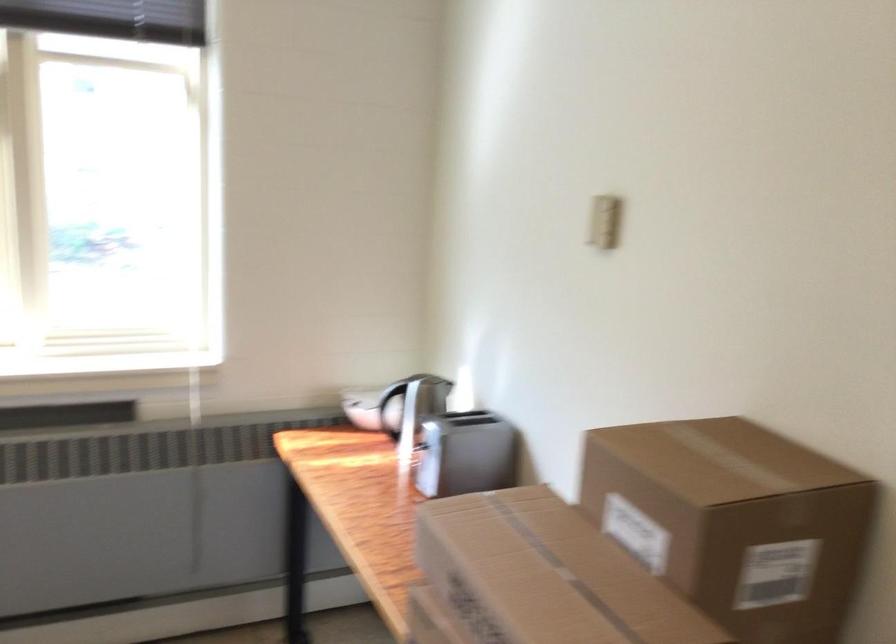
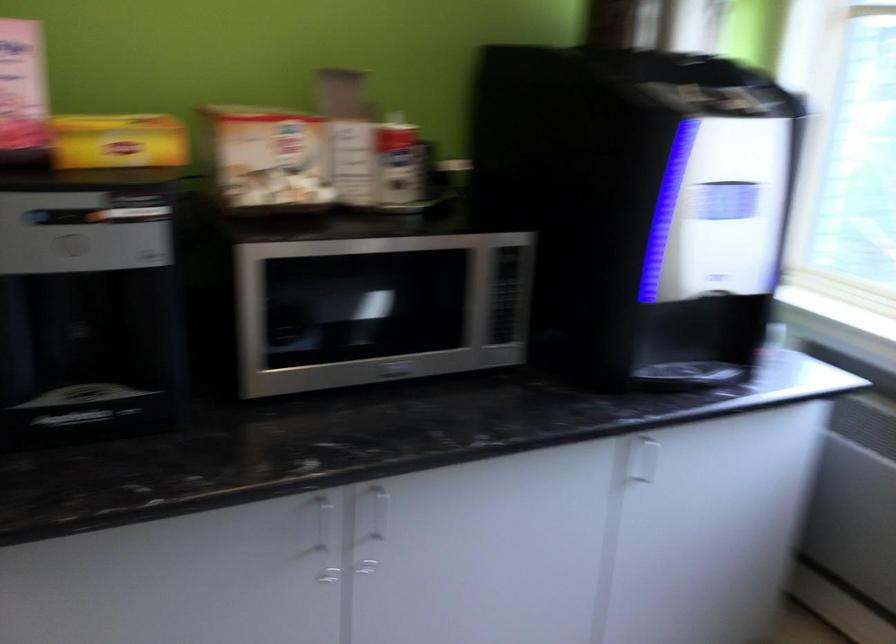
Question: The images are taken continuously from a first-person perspective. In which direction is your viewpoint rotating?

Choices:
 (A) Left
 (B) Right
 (C) Up
 (D) Down

Answer: (A)